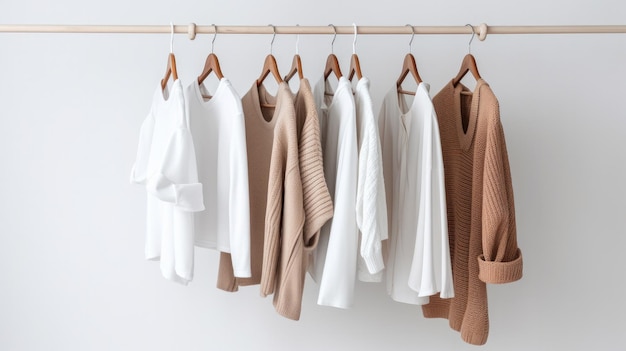
The height and width of the screenshot is (351, 626). Identify the location of wire hook on clothes hanger. (473, 30), (413, 31), (355, 33), (334, 30), (298, 32), (274, 33), (212, 34), (171, 31).